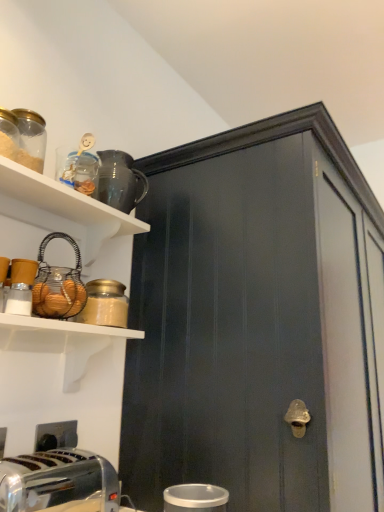
Question: In terms of size, does matte black cabinet at center appear bigger or smaller than glossy ceramic pitcher at upper center, the 3th appliance when ordered from bottom to top?

Choices:
 (A) big
 (B) small

Answer: (A)

Question: In terms of height, does matte black cabinet at center look taller or shorter compared to glossy ceramic pitcher at upper center, acting as the 1th appliance starting from the back?

Choices:
 (A) tall
 (B) short

Answer: (A)

Question: Which object is the farthest from the matte black cabinet at center?

Choices:
 (A) polished chrome toaster at lower left
 (B) matte black mug at upper left
 (C) white glossy cup at lower center, the third appliance positioned from the top
 (D) matte glass jar at upper left
 (E) glossy ceramic pitcher at upper center, which appears as the second appliance when viewed from the right

Answer: (C)

Question: Considering the real-world distances, which object is farthest from the glossy ceramic pitcher at upper center, the 3th appliance when ordered from bottom to top?

Choices:
 (A) matte black cabinet at center
 (B) wire basket at upper left, which is counted as the second appliance, starting from the bottom
 (C) matte black mug at upper left
 (D) white glossy cup at lower center, the first appliance from the bottom
 (E) matte glass jar at upper left

Answer: (D)